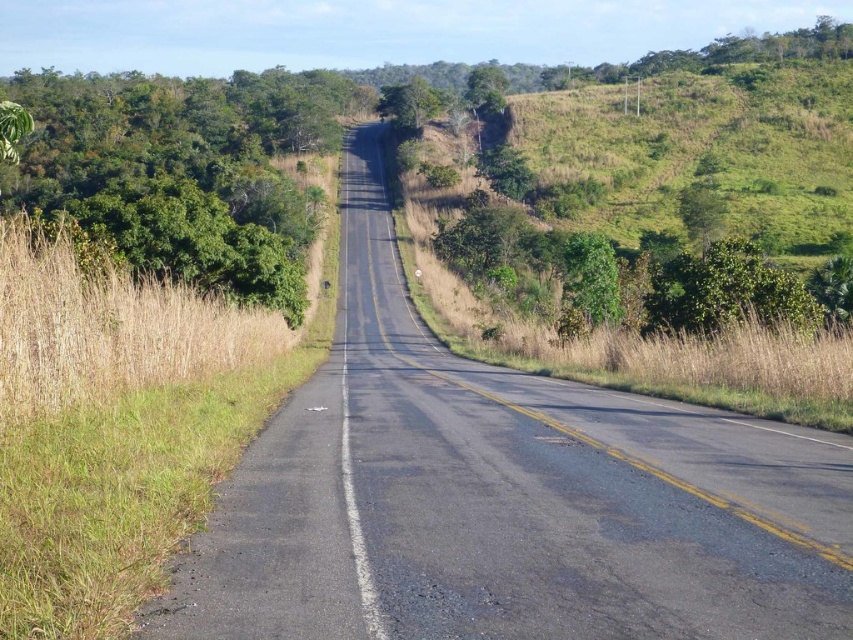
The image size is (853, 640). What do you see at coordinates (503, 497) in the screenshot? I see `black asphalt highway at center` at bounding box center [503, 497].

Can you confirm if black asphalt highway at center is bigger than green leafy tree at left?

No, black asphalt highway at center is not bigger than green leafy tree at left.

Find the location of a particular element. This screenshot has height=640, width=853. black asphalt highway at center is located at coordinates (503, 497).

I want to click on black asphalt highway at center, so click(x=503, y=497).

Is black asphalt highway at center taller than green leafy tree at center?

No, black asphalt highway at center is not taller than green leafy tree at center.

Is point (381, 132) closer to viewer compared to point (434, 90)?

No.

Which is behind, point (474, 628) or point (421, 84)?

The point (421, 84) is behind.

The height and width of the screenshot is (640, 853). Identify the location of black asphalt highway at center. (503, 497).

Who is shorter, green leafy tree at left or green leafy tree at center?

With less height is green leafy tree at center.

Which is below, green leafy tree at left or green leafy tree at center?

green leafy tree at left

At what (x,y) coordinates should I click in order to perform the action: click on green leafy tree at left. Please return your answer as a coordinate pair (x, y). This screenshot has width=853, height=640. Looking at the image, I should click on (184, 170).